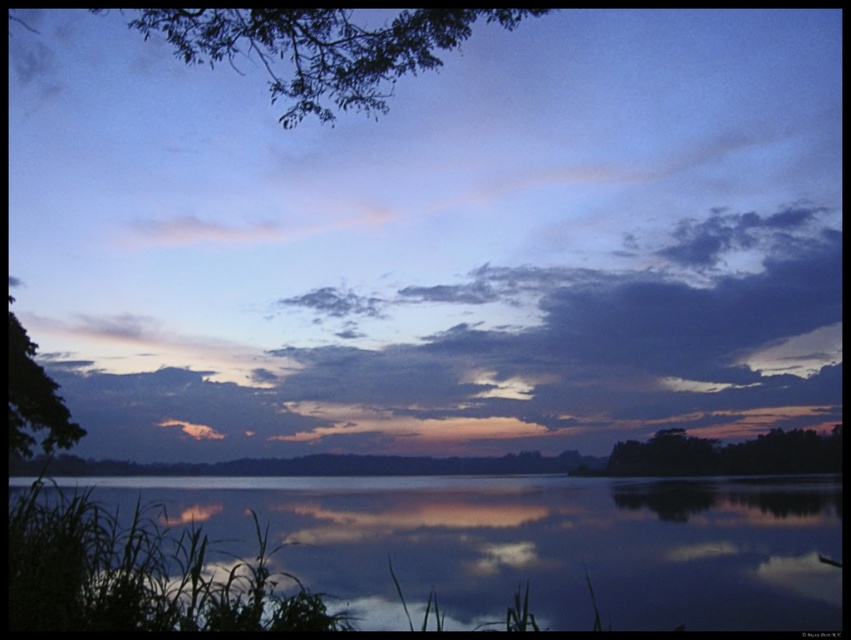
Looking at this image, you are an artist trying to paint the sunset scene. You need to decide which object to paint first based on their sizes. According to the scene, which object should you start with, the cloudy sky at upper center or the green leafy tree at upper left?

The cloudy sky at upper center is larger in size than the green leafy tree at upper left, so you should start with the cloudy sky at upper center as it requires more space and detail.

You are an artist trying to paint the sunset scene. You notice the green leafy tree at upper left and the dark green leafy tree at right. Which tree should you paint wider to maintain the scene balance?

The green leafy tree at upper left should be painted wider than the dark green leafy tree at right to maintain the scene balance.